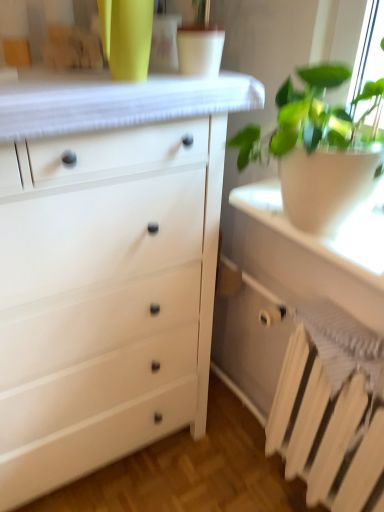
Question: Is white matte chest of drawers at left closer to the viewer compared to white painted metal radiator at lower right?

Choices:
 (A) yes
 (B) no

Answer: (A)

Question: Is the depth of white matte chest of drawers at left greater than that of white painted metal radiator at lower right?

Choices:
 (A) yes
 (B) no

Answer: (B)

Question: Is white matte chest of drawers at left not inside white painted metal radiator at lower right?

Choices:
 (A) no
 (B) yes

Answer: (B)

Question: From a real-world perspective, does white matte chest of drawers at left sit lower than white painted metal radiator at lower right?

Choices:
 (A) yes
 (B) no

Answer: (B)

Question: Considering the relative sizes of white matte chest of drawers at left and white painted metal radiator at lower right in the image provided, is white matte chest of drawers at left bigger than white painted metal radiator at lower right?

Choices:
 (A) yes
 (B) no

Answer: (A)

Question: Looking at their shapes, would you say white matte pot at right is wider or thinner than white matte radiator at lower right?

Choices:
 (A) thin
 (B) wide

Answer: (B)

Question: Is white matte pot at right taller or shorter than white matte radiator at lower right?

Choices:
 (A) short
 (B) tall

Answer: (A)

Question: Do you think white matte pot at right is within white matte radiator at lower right, or outside of it?

Choices:
 (A) inside
 (B) outside

Answer: (B)

Question: From the image's perspective, is white matte pot at right above or below white matte radiator at lower right?

Choices:
 (A) above
 (B) below

Answer: (A)

Question: From a real-world perspective, is white matte pot at right above or below white matte chest of drawers at left?

Choices:
 (A) below
 (B) above

Answer: (B)

Question: Considering the positions of white matte pot at right and white matte chest of drawers at left in the image, is white matte pot at right bigger or smaller than white matte chest of drawers at left?

Choices:
 (A) small
 (B) big

Answer: (A)

Question: Based on their positions, is white matte pot at right located to the left or right of white matte chest of drawers at left?

Choices:
 (A) left
 (B) right

Answer: (B)

Question: Considering the positions of white matte pot at right and white matte chest of drawers at left in the image, is white matte pot at right wider or thinner than white matte chest of drawers at left?

Choices:
 (A) wide
 (B) thin

Answer: (B)

Question: In terms of width, does white matte chest of drawers at left look wider or thinner when compared to white painted metal radiator at lower right?

Choices:
 (A) thin
 (B) wide

Answer: (B)

Question: Relative to white painted metal radiator at lower right, is white matte chest of drawers at left in front or behind?

Choices:
 (A) front
 (B) behind

Answer: (A)